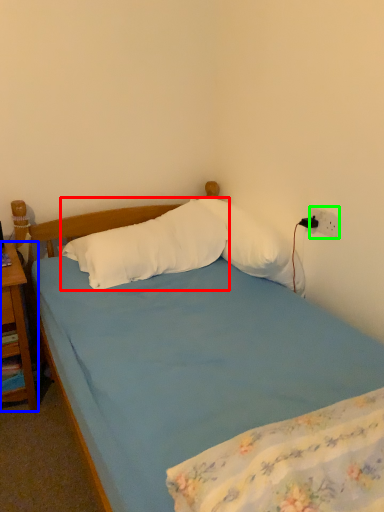
Question: Which object is positioned farthest from pillow (highlighted by a red box)? Select from nightstand (highlighted by a blue box) and power outlet (highlighted by a green box).

Choices:
 (A) nightstand
 (B) power outlet

Answer: (B)